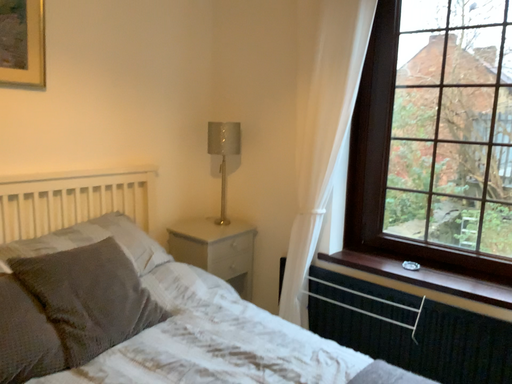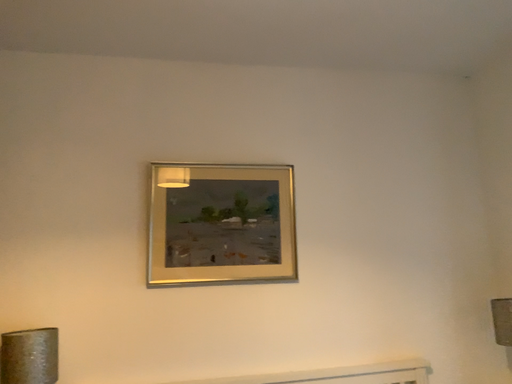
Question: Which way did the camera rotate in the video?

Choices:
 (A) rotated upward
 (B) rotated downward

Answer: (A)